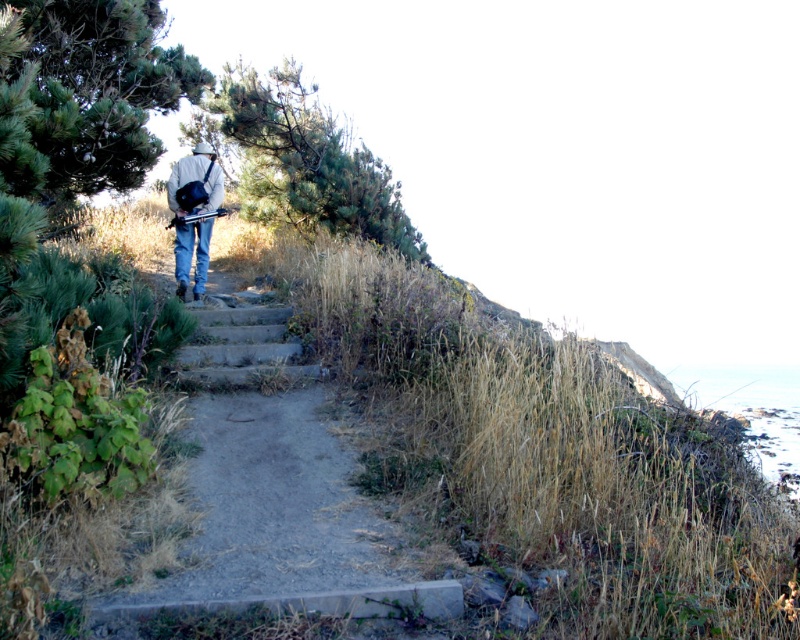
You are a photographer standing at the bottom of the stairs and want to take a photo of the denim jacket at upper center without the dull concrete steps at center appearing in the frame. Which side should you position yourself to achieve this?

The dull concrete steps at center are on the right side of the denim jacket at upper center. To avoid including them in the photo, you should position yourself to the right side of the denim jacket at upper center so that the steps are out of the frame.

You are standing at the bottom of the stairs and want to reach the person wearing the denim jacket at upper center. Which direction should you move relative to the dull concrete steps at center?

The denim jacket at upper center is located above the dull concrete steps at center, so you should move upward along the dull concrete steps at center to reach the person wearing the denim jacket at upper center.